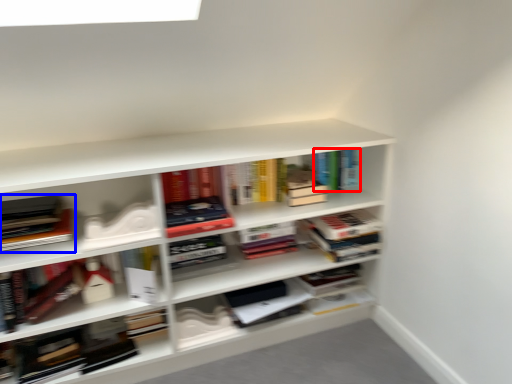
Question: Which object is closer to the camera taking this photo, book (highlighted by a red box) or book (highlighted by a blue box)?

Choices:
 (A) book
 (B) book

Answer: (B)